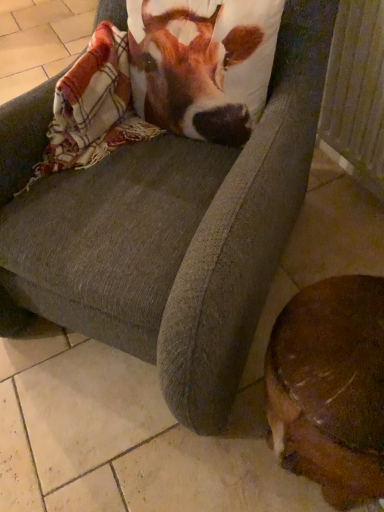
Question: Can you confirm if brown furry dog at lower right is thinner than plaid woolen blanket at upper left?

Choices:
 (A) no
 (B) yes

Answer: (A)

Question: From the image's perspective, is brown furry dog at lower right located above plaid woolen blanket at upper left?

Choices:
 (A) no
 (B) yes

Answer: (A)

Question: Is brown furry dog at lower right far from plaid woolen blanket at upper left?

Choices:
 (A) yes
 (B) no

Answer: (B)

Question: Can we say brown furry dog at lower right lies outside plaid woolen blanket at upper left?

Choices:
 (A) yes
 (B) no

Answer: (A)

Question: Is brown furry dog at lower right positioned with its back to plaid woolen blanket at upper left?

Choices:
 (A) yes
 (B) no

Answer: (B)

Question: In terms of height, does wooden radiator at lower right look taller or shorter compared to plaid woolen blanket at upper left?

Choices:
 (A) tall
 (B) short

Answer: (A)

Question: Considering the positions of wooden radiator at lower right and plaid woolen blanket at upper left in the image, is wooden radiator at lower right bigger or smaller than plaid woolen blanket at upper left?

Choices:
 (A) big
 (B) small

Answer: (A)

Question: Does point (365, 183) appear closer or farther from the camera than point (94, 48)?

Choices:
 (A) closer
 (B) farther

Answer: (B)

Question: Based on their positions, is wooden radiator at lower right located to the left or right of plaid woolen blanket at upper left?

Choices:
 (A) left
 (B) right

Answer: (B)

Question: From the image's perspective, relative to brown furry dog at lower right, is brown and white fabric at upper center above or below?

Choices:
 (A) below
 (B) above

Answer: (B)

Question: In the image, is brown and white fabric at upper center on the left side or the right side of brown furry dog at lower right?

Choices:
 (A) right
 (B) left

Answer: (B)

Question: Is brown and white fabric at upper center in front of or behind brown furry dog at lower right in the image?

Choices:
 (A) behind
 (B) front

Answer: (A)

Question: Considering the positions of brown and white fabric at upper center and brown furry dog at lower right in the image, is brown and white fabric at upper center bigger or smaller than brown furry dog at lower right?

Choices:
 (A) big
 (B) small

Answer: (B)

Question: Considering the positions of wooden radiator at lower right and brown and white fabric at upper center in the image, is wooden radiator at lower right wider or thinner than brown and white fabric at upper center?

Choices:
 (A) thin
 (B) wide

Answer: (A)

Question: From a real-world perspective, is wooden radiator at lower right above or below brown and white fabric at upper center?

Choices:
 (A) below
 (B) above

Answer: (A)